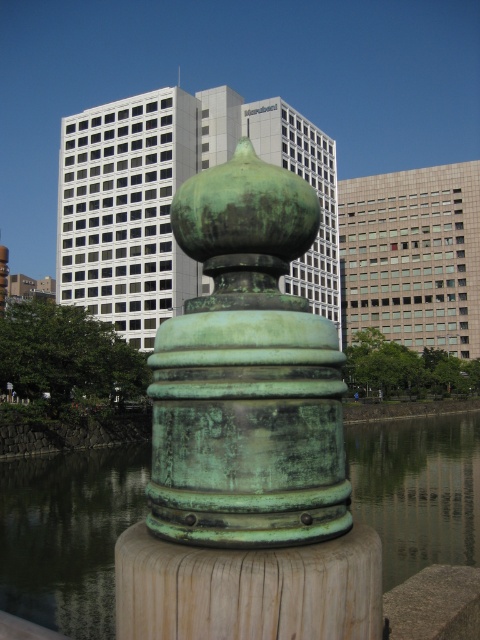
Question: Which point is closer to the camera?

Choices:
 (A) (425, 502)
 (B) (315, 536)

Answer: (B)

Question: Which point appears closest to the camera in this image?

Choices:
 (A) (111, 632)
 (B) (275, 260)

Answer: (B)

Question: Does green patina cylinder at center have a lesser width compared to green patina water at center?

Choices:
 (A) no
 (B) yes

Answer: (B)

Question: Can you confirm if green patina cylinder at center is positioned to the left of green patina water at center?

Choices:
 (A) yes
 (B) no

Answer: (A)

Question: Does green patina cylinder at center appear over green patina water at center?

Choices:
 (A) yes
 (B) no

Answer: (A)